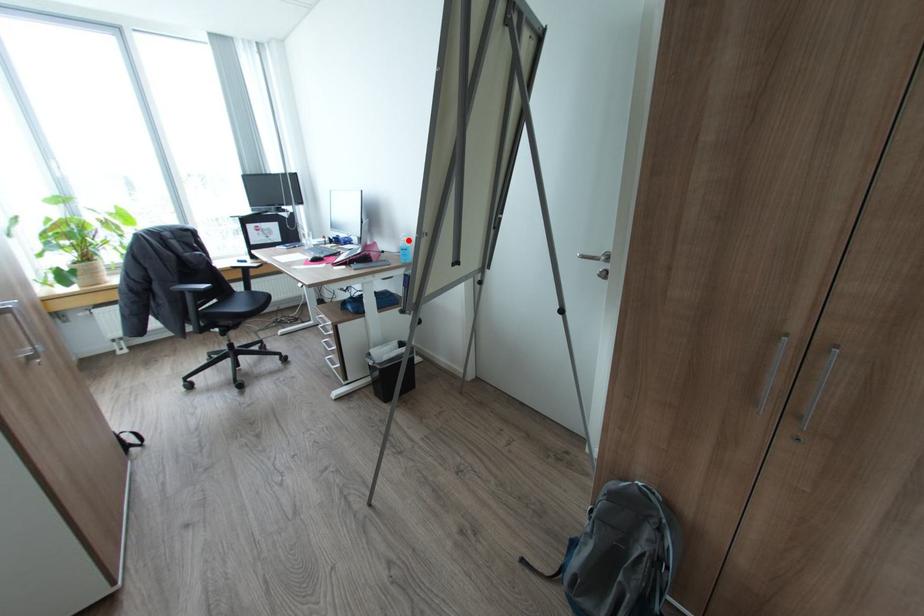
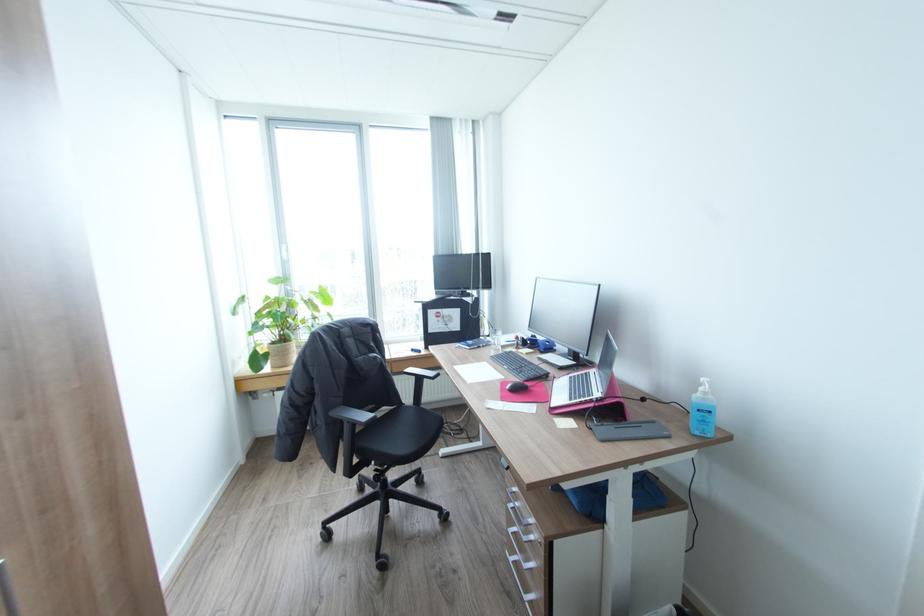
Find the pixel in the second image that matches the highlighted location in the first image.

(710, 392)